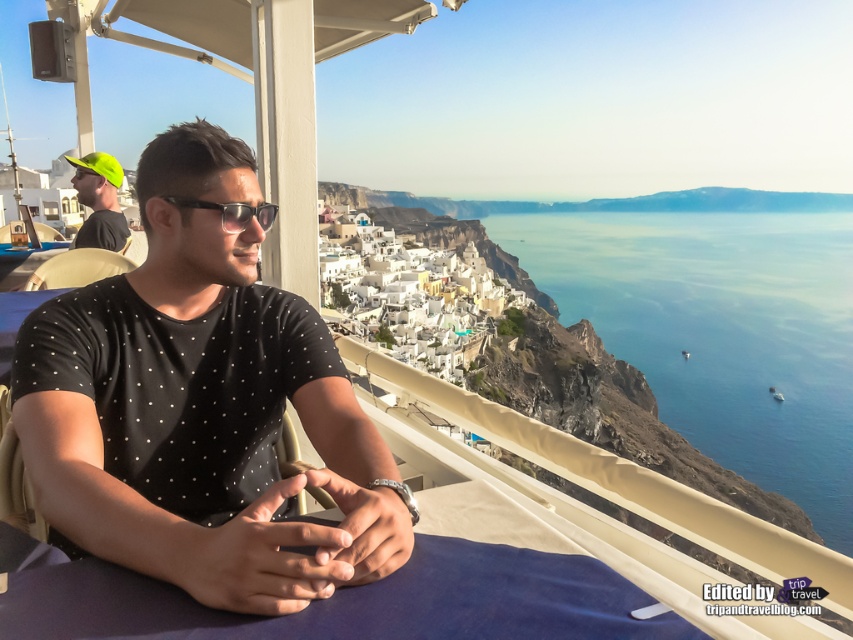
Question: Based on their relative distances, which object is farther from the black dotted shirt at center?

Choices:
 (A) black plastic sunglasses at center
 (B) neon yellow cap at upper left

Answer: (B)

Question: Considering the relative positions of neon yellow cap at upper left and black plastic sunglasses at center in the image provided, where is neon yellow cap at upper left located with respect to black plastic sunglasses at center?

Choices:
 (A) below
 (B) above

Answer: (B)

Question: Which point is farther to the camera?

Choices:
 (A) (136, 358)
 (B) (97, 208)
 (C) (201, 204)

Answer: (B)

Question: Can you confirm if neon yellow cap at upper left is wider than black plastic sunglasses at center?

Choices:
 (A) yes
 (B) no

Answer: (A)

Question: Is neon yellow cap at upper left to the right of black plastic sunglasses at center from the viewer's perspective?

Choices:
 (A) yes
 (B) no

Answer: (B)

Question: Which object appears farthest from the camera in this image?

Choices:
 (A) black dotted shirt at center
 (B) neon yellow cap at upper left
 (C) black plastic sunglasses at center

Answer: (B)